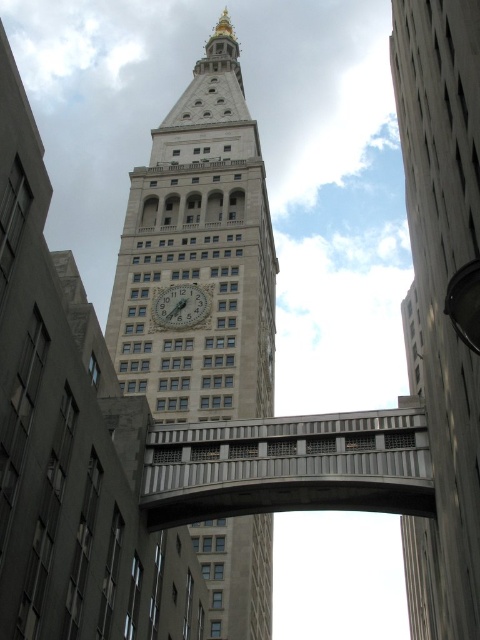
You are an architect reviewing the blueprint of the historic building. The beige stone clock tower at center and the gold metallic clock at center are both part of the design. Which of the two is larger in size according to the blueprint?

The beige stone clock tower at center is bigger than the gold metallic clock at center according to the blueprint.

You are standing at the base of the historic building and want to walk towards the two points marked in the image. Which point, point (180, 369) or point (166, 316), will you reach first?

Point (180, 369) is closer to the viewer than point (166, 316), so you will reach point (180, 369) first.